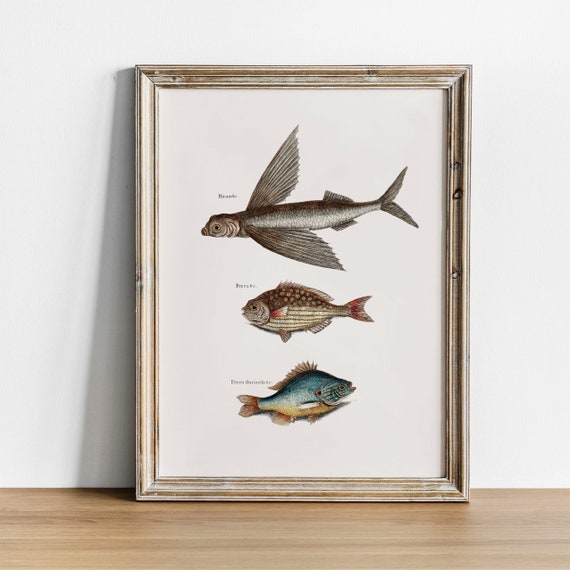
Identify the location of brown wood table surface. Image resolution: width=570 pixels, height=570 pixels. (365, 533).